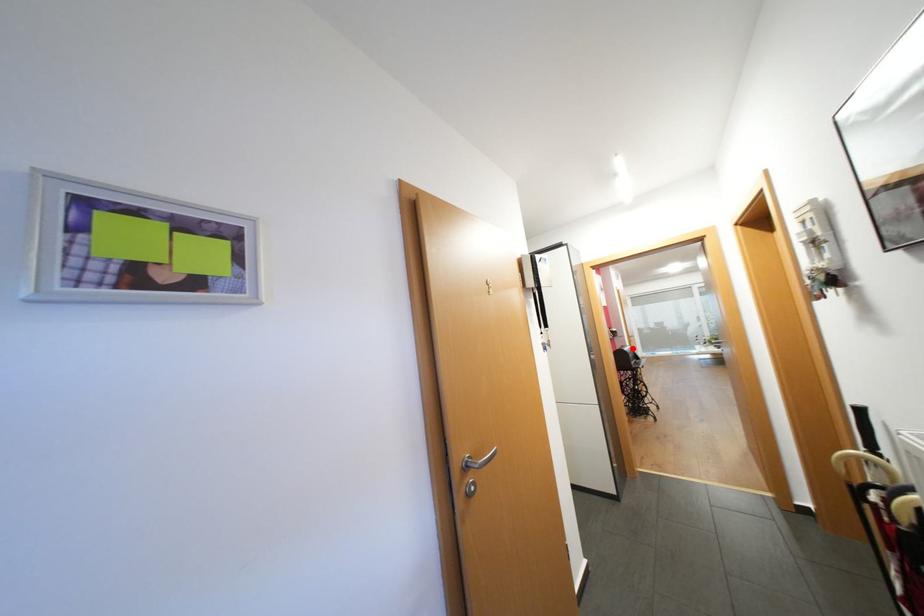
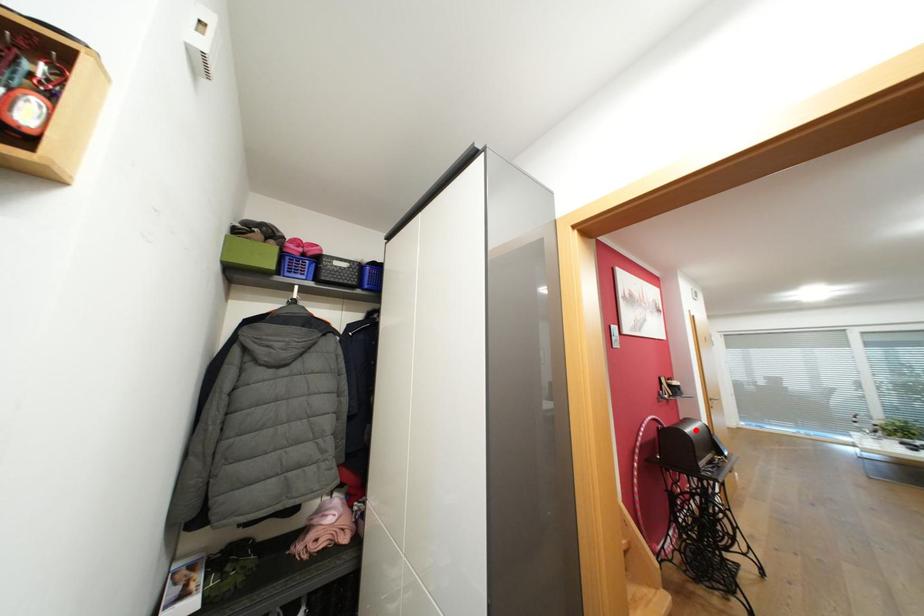
I am providing you with two images of the same scene from different viewpoints. A red point is marked on the first image and another point is marked on the second image. Are the points marked in image1 and image2 representing the same 3D position?

Yes